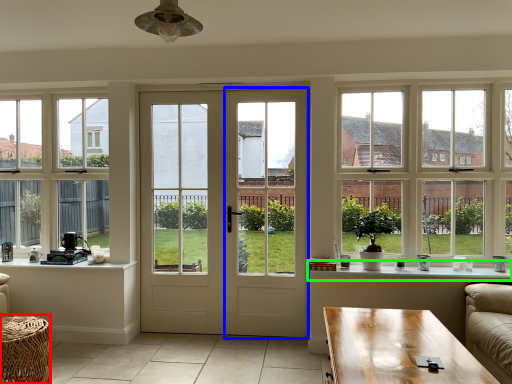
Question: Which is nearer to the table (highlighted by a red box)? screen door (highlighted by a blue box) or window sill (highlighted by a green box).

Choices:
 (A) screen door
 (B) window sill

Answer: (A)